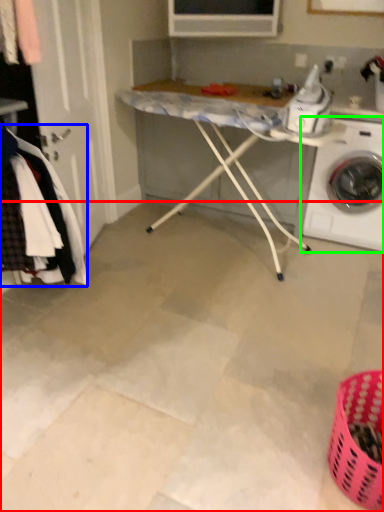
Question: Which is nearer to the concrete (highlighted by a red box)? clothing (highlighted by a blue box) or washing machine (highlighted by a green box).

Choices:
 (A) clothing
 (B) washing machine

Answer: (A)